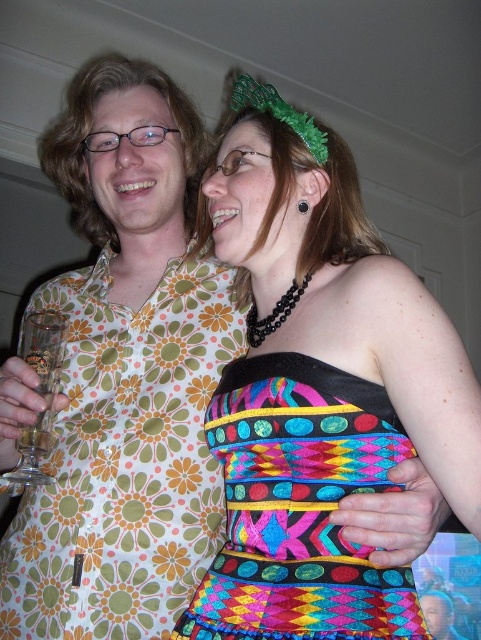
Can you confirm if floral-patterned shirt at center is taller than multicolored woven dress at center?

Yes, floral-patterned shirt at center is taller than multicolored woven dress at center.

Can you confirm if floral-patterned shirt at center is smaller than multicolored woven dress at center?

Incorrect, floral-patterned shirt at center is not smaller in size than multicolored woven dress at center.

Who is more distant from viewer, (112, 400) or (329, 548)?

Positioned behind is point (112, 400).

Where is `floral-patterned shirt at center`? Image resolution: width=481 pixels, height=640 pixels. floral-patterned shirt at center is located at coordinates (126, 374).

Looking at this image, can you confirm if multicolored woven dress at center is positioned to the right of clear glass wine glass at left?

Indeed, multicolored woven dress at center is positioned on the right side of clear glass wine glass at left.

Is point (294, 593) closer to viewer compared to point (19, 352)?

Yes, point (294, 593) is closer to viewer.

I want to click on multicolored woven dress at center, so click(x=300, y=508).

Does point (303, 280) come in front of point (326, 529)?

No.

How distant is multicolored fabric dress at center from multicolored woven dress at center?

multicolored fabric dress at center and multicolored woven dress at center are 5.93 centimeters apart.

Who is more distant from viewer, (291,506) or (298,468)?

The point (298,468) is behind.

Find the location of a particular element. This screenshot has height=640, width=481. multicolored fabric dress at center is located at coordinates (319, 388).